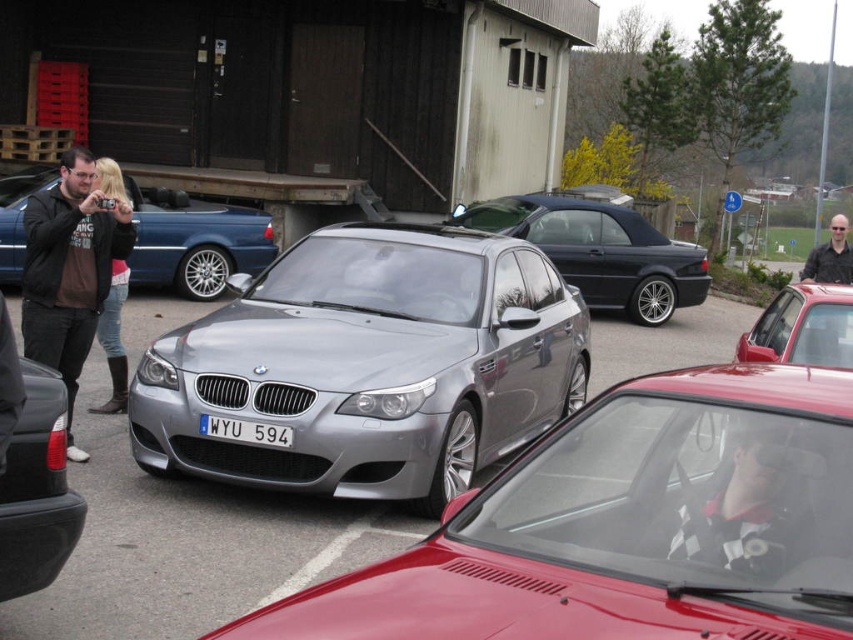
What do you see at coordinates (630, 525) in the screenshot?
I see `satin silver car at center` at bounding box center [630, 525].

Identify the location of satin silver car at center. (630, 525).

Between checkered fabric shirt at center and white plastic license plate at center, which one appears on the left side from the viewer's perspective?

white plastic license plate at center

At what (x,y) coordinates should I click in order to perform the action: click on checkered fabric shirt at center. Please return your answer as a coordinate pair (x, y). Looking at the image, I should click on (747, 500).

This screenshot has height=640, width=853. What are the coordinates of `satin silver metallic sedan at left` in the screenshot? It's located at (194, 241).

Between satin silver metallic sedan at left and smooth black shirt at upper right, which one has less height?

satin silver metallic sedan at left

Measure the distance between satin silver metallic sedan at left and camera.

34.59 feet

Where is `satin silver metallic sedan at left`? The width and height of the screenshot is (853, 640). satin silver metallic sedan at left is located at coordinates (194, 241).